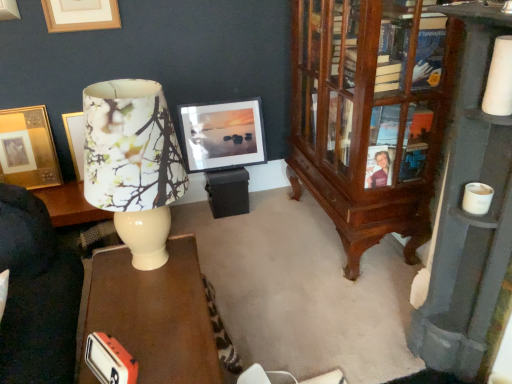
Question: Considering the relative sizes of wooden cabinet at right and matte black picture frame at center, positioned as the 3th picture frame in left-to-right order, in the image provided, is wooden cabinet at right taller than matte black picture frame at center, positioned as the 3th picture frame in left-to-right order,?

Choices:
 (A) yes
 (B) no

Answer: (A)

Question: Is the position of wooden cabinet at right less distant than that of matte black picture frame at center, which is the 1th picture frame from right to left?

Choices:
 (A) no
 (B) yes

Answer: (B)

Question: Does wooden cabinet at right come behind matte black picture frame at center, positioned as the 3th picture frame in left-to-right order?

Choices:
 (A) yes
 (B) no

Answer: (B)

Question: From a real-world perspective, is wooden cabinet at right positioned over matte black picture frame at center, which is the 1th picture frame from right to left, based on gravity?

Choices:
 (A) yes
 (B) no

Answer: (A)

Question: Is wooden cabinet at right surrounding matte black picture frame at center, positioned as the 3th picture frame in left-to-right order?

Choices:
 (A) yes
 (B) no

Answer: (B)

Question: Looking at their shapes, would you say matte black picture frame at center, which is the 1th picture frame from right to left, is wider or thinner than floral paper lampshade at left?

Choices:
 (A) thin
 (B) wide

Answer: (A)

Question: From the image's perspective, is matte black picture frame at center, which is the 1th picture frame from right to left, positioned above or below floral paper lampshade at left?

Choices:
 (A) below
 (B) above

Answer: (B)

Question: Considering the positions of matte black picture frame at center, which is the 1th picture frame from right to left, and floral paper lampshade at left in the image, is matte black picture frame at center, which is the 1th picture frame from right to left, bigger or smaller than floral paper lampshade at left?

Choices:
 (A) big
 (B) small

Answer: (B)

Question: Relative to floral paper lampshade at left, is matte black picture frame at center, which is the 1th picture frame from right to left, in front or behind?

Choices:
 (A) front
 (B) behind

Answer: (B)

Question: From the image's perspective, is white glossy desk at lower left located above or below wooden cabinet at right?

Choices:
 (A) above
 (B) below

Answer: (B)

Question: Is point (87, 289) positioned closer to the camera than point (431, 175)?

Choices:
 (A) farther
 (B) closer

Answer: (B)

Question: Relative to wooden cabinet at right, is white glossy desk at lower left in front or behind?

Choices:
 (A) behind
 (B) front

Answer: (B)

Question: Considering the positions of white glossy desk at lower left and wooden cabinet at right in the image, is white glossy desk at lower left taller or shorter than wooden cabinet at right?

Choices:
 (A) tall
 (B) short

Answer: (B)

Question: Is white glossy desk at lower left to the left or to the right of wooden bookcase at right in the image?

Choices:
 (A) left
 (B) right

Answer: (A)

Question: In terms of height, does white glossy desk at lower left look taller or shorter compared to wooden bookcase at right?

Choices:
 (A) short
 (B) tall

Answer: (A)